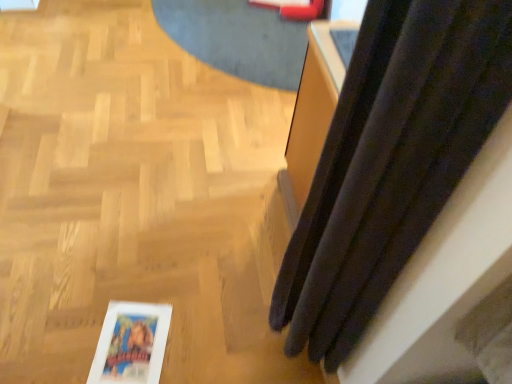
Find the location of a particular element. This screenshot has width=512, height=384. empty space that is ontop of white glossy magazine at lower left is located at coordinates (129, 347).